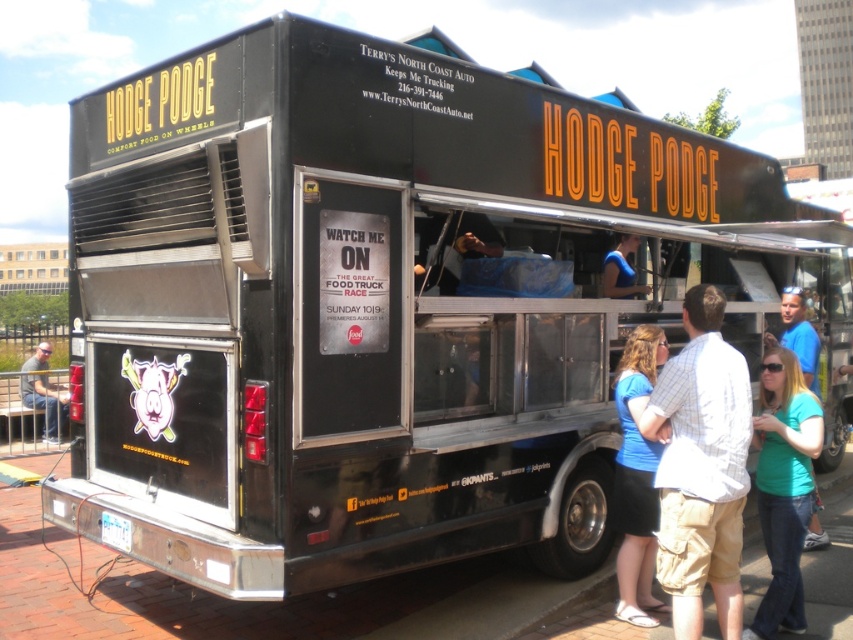
Question: Is blue cotton shirt at center positioned at the back of blue fabric shirt at center?

Choices:
 (A) no
 (B) yes

Answer: (A)

Question: Which object is farther from the camera taking this photo?

Choices:
 (A) light blue shirt at center
 (B) matte gray shirt at lower left

Answer: (B)

Question: Can you confirm if green matte shirt at lower right is thinner than blue fabric shirt at center?

Choices:
 (A) no
 (B) yes

Answer: (A)

Question: Which point is closer to the camera taking this photo?

Choices:
 (A) (735, 566)
 (B) (804, 298)
 (C) (641, 506)

Answer: (A)

Question: Does light blue shirt at center have a larger size compared to blue fabric shirt at center?

Choices:
 (A) no
 (B) yes

Answer: (B)

Question: Which object is positioned farthest from the green matte shirt at lower right?

Choices:
 (A) teal shirt at center
 (B) blue fabric shirt at center

Answer: (B)